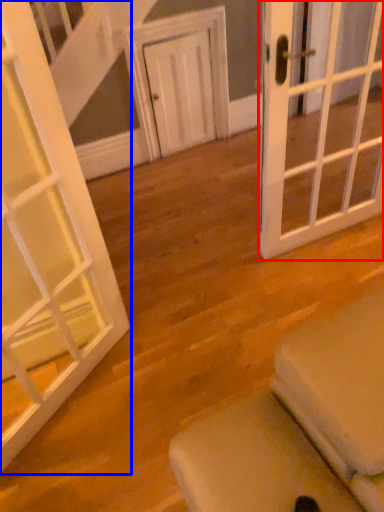
Question: Which object appears closest to the camera in this image, door (highlighted by a red box) or door (highlighted by a blue box)?

Choices:
 (A) door
 (B) door

Answer: (B)